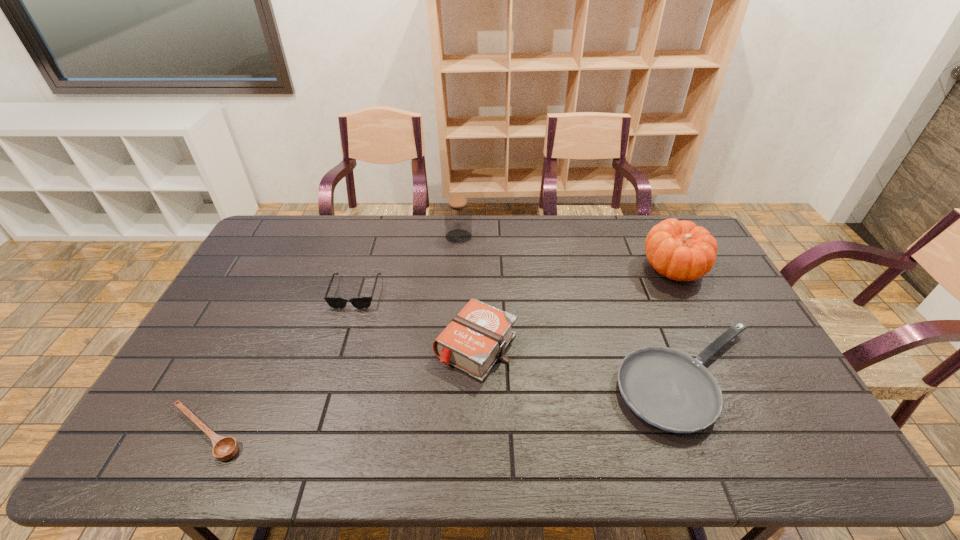
At what (x,y) coordinates should I click in order to perform the action: click on vacant space in between the sunglasses and the jar. Please return your answer as a coordinate pair (x, y). Looking at the image, I should click on (407, 265).

You are a GUI agent. You are given a task and a screenshot of the screen. Output one action in this format:
    pyautogui.click(x=<x>, y=<y>)
    Task: Click on the free space between the leftmost object and the Bible
    
    Given the screenshot: What is the action you would take?
    pyautogui.click(x=341, y=390)

Locate an element on the screen. The height and width of the screenshot is (540, 960). vacant area that lies between the pumpkin and the Bible is located at coordinates (575, 307).

This screenshot has width=960, height=540. What are the coordinates of `empty space between the pumpkin and the jar` in the screenshot? It's located at (566, 252).

The image size is (960, 540). I want to click on free space between the pumpkin and the Bible, so click(575, 307).

At what (x,y) coordinates should I click in order to perform the action: click on free space between the sunglasses and the Bible. Please return your answer as a coordinate pair (x, y). The image size is (960, 540). Looking at the image, I should click on (416, 320).

The image size is (960, 540). Identify the location of empty space that is in between the pumpkin and the third shortest object. (515, 280).

You are a GUI agent. You are given a task and a screenshot of the screen. Output one action in this format:
    pyautogui.click(x=<x>, y=<y>)
    Task: Click on the second closest object relative to the farthest object
    This screenshot has height=540, width=960.
    Given the screenshot: What is the action you would take?
    pyautogui.click(x=476, y=338)

Where is `object that ranks as the fourth closest to the fifth object from right to left`? object that ranks as the fourth closest to the fifth object from right to left is located at coordinates (669, 389).

Locate an element on the screen. The height and width of the screenshot is (540, 960). vacant area that satisfies the following two spatial constraints: 1. at the front lenses of the third shortest object; 2. on the right side of the Bible is located at coordinates (339, 347).